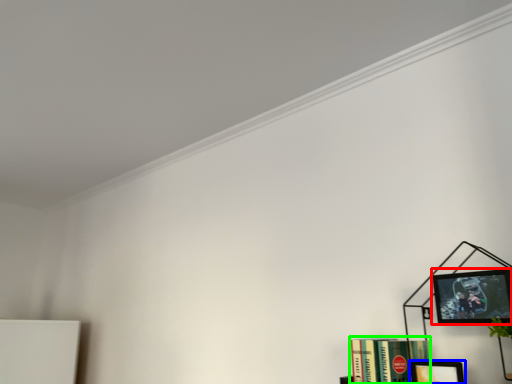
Question: Estimate the real-world distances between objects in this image. Which object is farther from picture frame (highlighted by a red box), picture frame (highlighted by a blue box) or book (highlighted by a green box)?

Choices:
 (A) picture frame
 (B) book

Answer: (B)